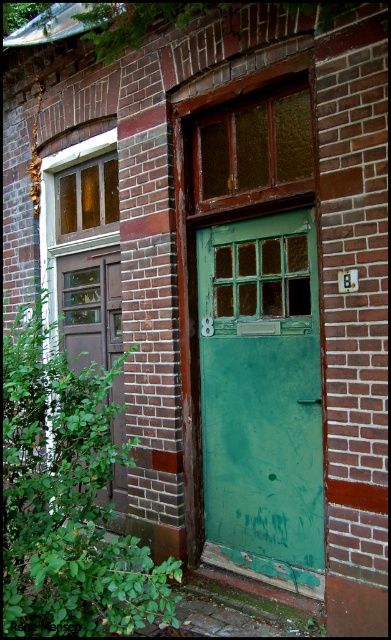
Question: Among these points, which one is farthest from the camera?

Choices:
 (A) (265, 573)
 (B) (87, 308)

Answer: (B)

Question: Estimate the real-world distances between objects in this image. Which object is farther from the amber stained glass window at upper left?

Choices:
 (A) matte brown door at left
 (B) wooden textured window at upper center
 (C) green matte door at center

Answer: (C)

Question: Does matte brown door at left lie behind amber stained glass window at upper left?

Choices:
 (A) yes
 (B) no

Answer: (B)

Question: Does green matte door at center lie in front of matte brown door at left?

Choices:
 (A) no
 (B) yes

Answer: (B)

Question: From the image, what is the correct spatial relationship of green matte door at center in relation to wooden textured window at upper center?

Choices:
 (A) below
 (B) above

Answer: (A)

Question: Considering the real-world distances, which object is closest to the matte brown door at left?

Choices:
 (A) wooden textured window at upper center
 (B) amber stained glass window at upper left

Answer: (B)